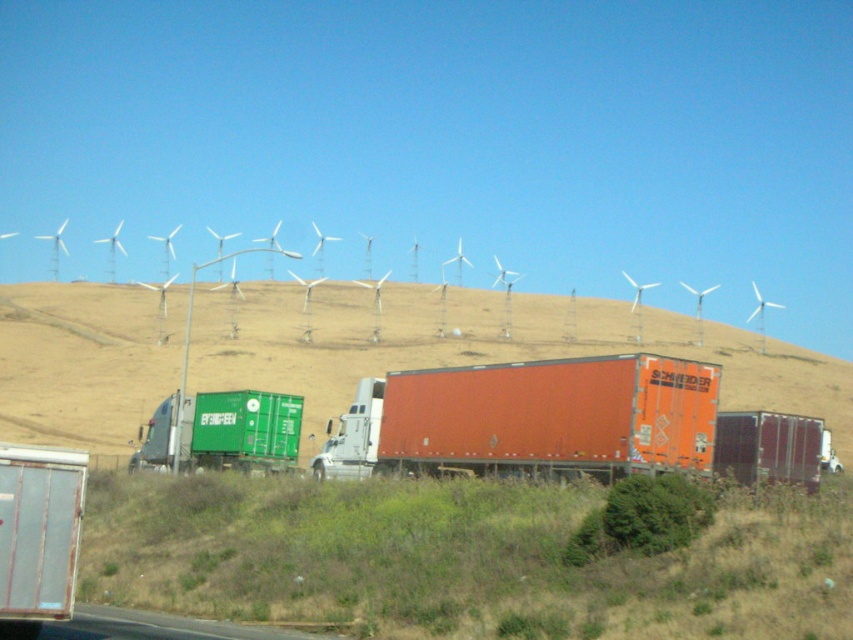
Question: Is orange matte trailer truck at center positioned before asphalt road at lower center?

Choices:
 (A) yes
 (B) no

Answer: (B)

Question: Among these points, which one is farthest from the camera?

Choices:
 (A) (144, 634)
 (B) (193, 436)

Answer: (B)

Question: Which of the following is the farthest from the observer?

Choices:
 (A) (705, 289)
 (B) (613, 476)

Answer: (A)

Question: Among these objects, which one is farthest from the camera?

Choices:
 (A) orange matte trailer truck at center
 (B) asphalt road at lower center

Answer: (A)

Question: Can you confirm if green matte container at left is positioned to the right of white plastic wind turbines at upper center?

Choices:
 (A) no
 (B) yes

Answer: (A)

Question: Considering the relative positions of orange matte trailer truck at center and green matte container at left in the image provided, where is orange matte trailer truck at center located with respect to green matte container at left?

Choices:
 (A) right
 (B) left

Answer: (A)